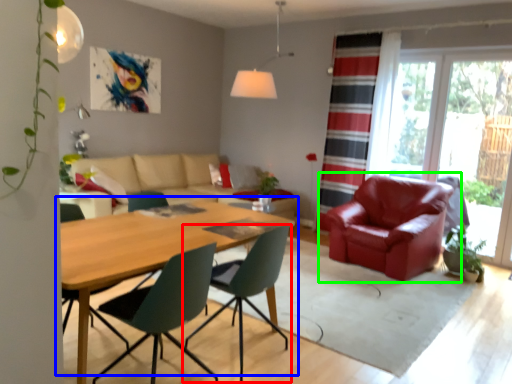
Question: Based on their relative distances, which object is nearer to chair (highlighted by a red box)? Choose from kitchen & dining room table (highlighted by a blue box) and chair (highlighted by a green box).

Choices:
 (A) kitchen & dining room table
 (B) chair

Answer: (A)